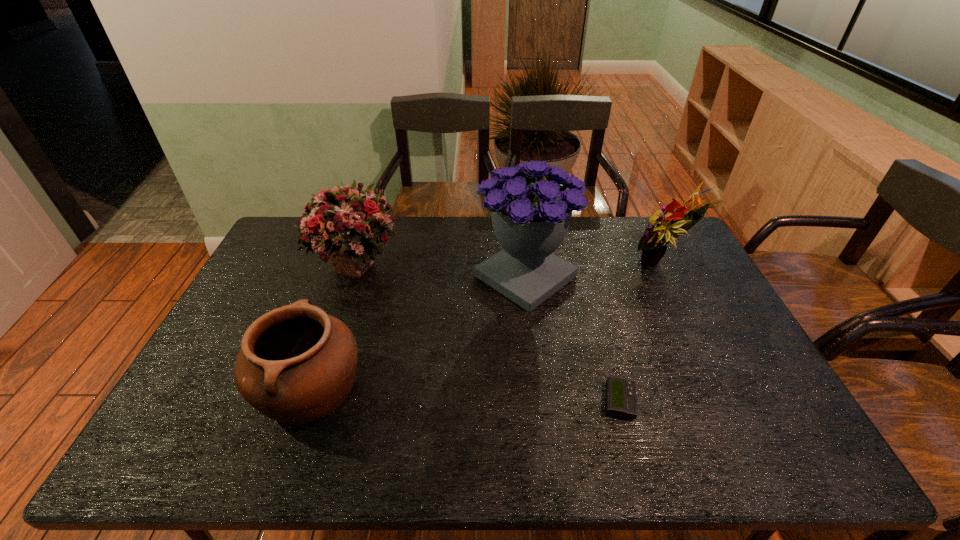
Where is `blank region between the beeper and the pottery`? The height and width of the screenshot is (540, 960). blank region between the beeper and the pottery is located at coordinates (465, 395).

This screenshot has width=960, height=540. I want to click on vacant region between the tallest bouquet and the beeper, so click(x=572, y=339).

The height and width of the screenshot is (540, 960). I want to click on unoccupied area between the tallest object and the rightmost object, so click(593, 271).

Find the location of `free spot between the second shortest object and the beeper`. free spot between the second shortest object and the beeper is located at coordinates (465, 395).

The height and width of the screenshot is (540, 960). What are the coordinates of `vacant point located between the second bouquet from left to right and the leftmost bouquet` in the screenshot? It's located at (441, 270).

This screenshot has width=960, height=540. Identify the location of vacant area that lies between the fourth tallest object and the rightmost object. (486, 327).

Locate an element on the screen. vacant region between the pottery and the rightmost object is located at coordinates (486, 327).

You are a GUI agent. You are given a task and a screenshot of the screen. Output one action in this format:
    pyautogui.click(x=<x>, y=<y>)
    Task: Click on the free space between the leftmost bouquet and the shortest object
    This screenshot has height=540, width=960.
    Given the screenshot: What is the action you would take?
    pyautogui.click(x=488, y=333)

Identify which object is the fourth closest to the pottery. Please provide its 2D coordinates. Your answer should be formatted as a tuple, i.e. [(x, y)], where the tuple contains the x and y coordinates of a point satisfying the conditions above.

[(653, 243)]

Identify which object is the second nearest to the leftmost bouquet. Please provide its 2D coordinates. Your answer should be formatted as a tuple, i.e. [(x, y)], where the tuple contains the x and y coordinates of a point satisfying the conditions above.

[(530, 216)]